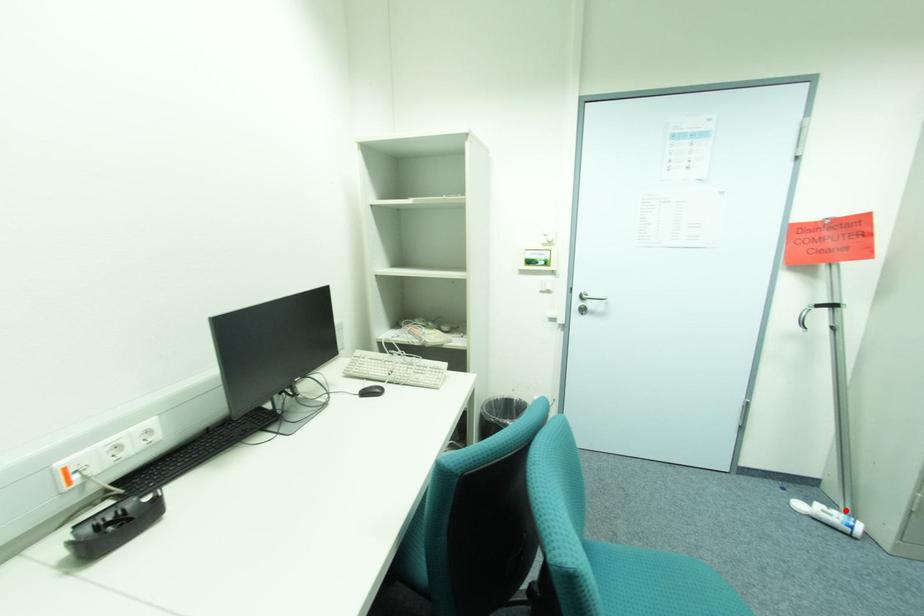
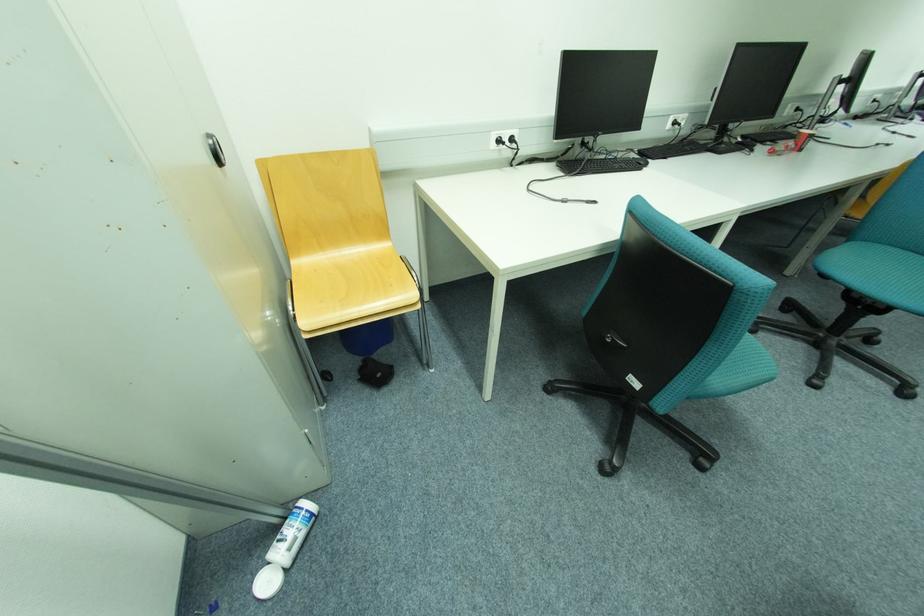
Question: I am providing you with two images of the same scene from different viewpoints. A red point is shown in image1. For the corresponding object point in image2, is it positioned nearer or farther from the camera?

Choices:
 (A) Nearer
 (B) Farther

Answer: (B)